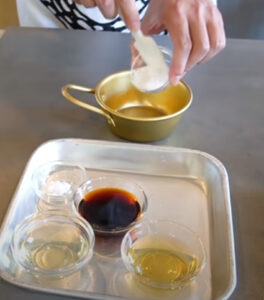
The image size is (264, 300). What are the coordinates of `tray` in the screenshot? It's located at (181, 199).